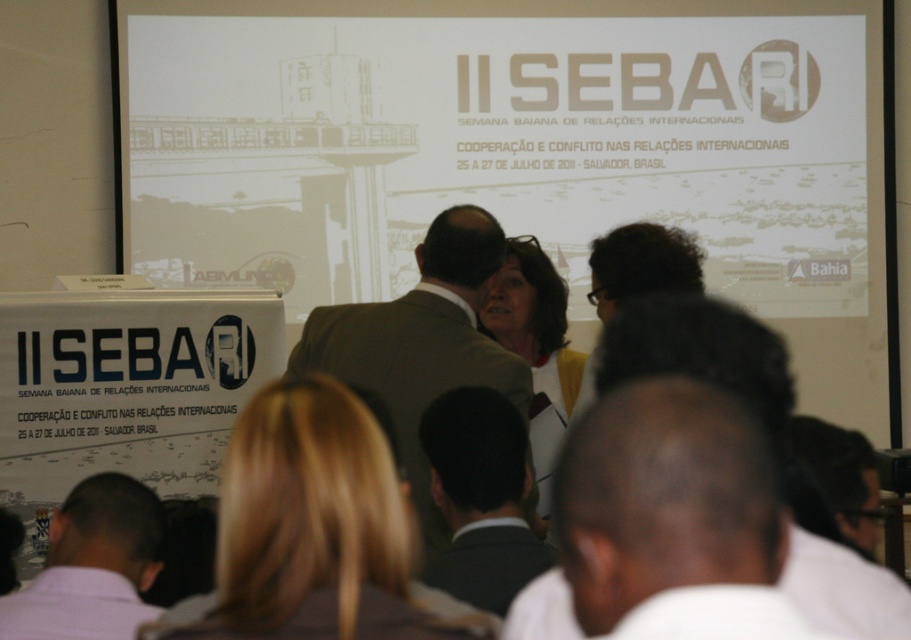
Between blonde hair at center and light brown suit at center, which one appears on the left side from the viewer's perspective?

Positioned to the left is blonde hair at center.

Is blonde hair at center taller than light brown suit at center?

Incorrect, blonde hair at center's height is not larger of light brown suit at center's.

You are a GUI agent. You are given a task and a screenshot of the screen. Output one action in this format:
    pyautogui.click(x=<x>, y=<y>)
    Task: Click on the blonde hair at center
    The image size is (911, 640).
    Given the screenshot: What is the action you would take?
    pyautogui.click(x=315, y=531)

Who is lower down, blonde hair at center or dark brown suit at center?

dark brown suit at center

Who is more distant from viewer, (246, 515) or (478, 582)?

The point (478, 582) is more distant.

Which is behind, point (362, 490) or point (473, 420)?

The point (473, 420) is behind.

In order to click on blonde hair at center in this screenshot , I will do `click(315, 531)`.

Which is below, dark brown suit at center or yellow fabric at center?

Positioned lower is dark brown suit at center.

I want to click on dark brown suit at center, so pos(480,497).

Where is `dark brown suit at center`? The image size is (911, 640). dark brown suit at center is located at coordinates (480, 497).